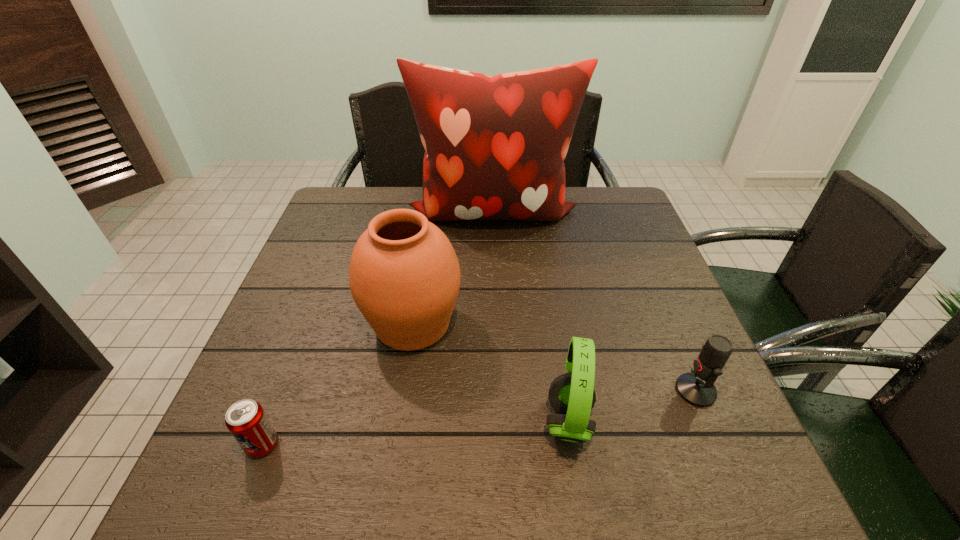
Where is `the tallest object`? This screenshot has width=960, height=540. the tallest object is located at coordinates (494, 146).

Identify the location of the farthest object. Image resolution: width=960 pixels, height=540 pixels. (494, 146).

This screenshot has width=960, height=540. I want to click on the fourth shortest object, so click(404, 275).

Identify the location of the second farthest object. (404, 275).

The width and height of the screenshot is (960, 540). In order to click on the third tallest object in this screenshot , I will do `click(572, 395)`.

Where is `the rightmost object`? The image size is (960, 540). the rightmost object is located at coordinates (697, 388).

Locate an element on the screen. This screenshot has height=540, width=960. the fourth tallest object is located at coordinates coord(697,388).

Identify the location of the leftmost object. The width and height of the screenshot is (960, 540). [x=246, y=420].

Where is `soda can`? soda can is located at coordinates (246, 420).

Where is `blank area located on the front-facing side of the cushion`? The width and height of the screenshot is (960, 540). blank area located on the front-facing side of the cushion is located at coordinates (494, 280).